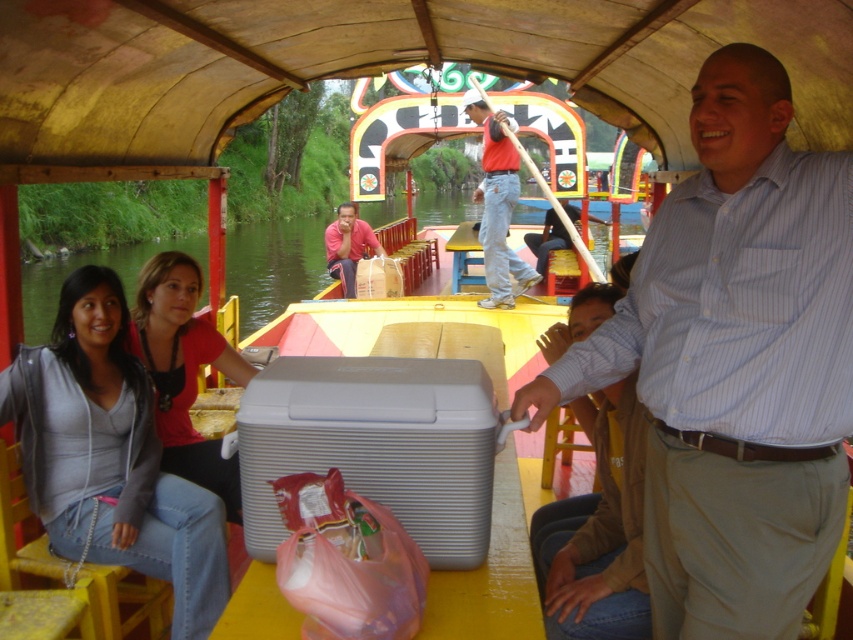
You are a photographer on the boat and want to take a photo of both the striped cotton shirt at center and the matte blue shirt at center. Since you want them both in focus, you need to know which one is taller. Which shirt is taller?

The striped cotton shirt at center is taller than the matte blue shirt at center.

Based on the photo, you are standing on the boat and want to hand a souvenir to a person wearing the striped cotton shirt at center. If you can reach up to 2 meters, will you be able to reach them?

The striped cotton shirt at center and the viewer are 2.40 meters apart, so you cannot reach them as your maximum reach is 2 meters.

You are a passenger on the boat and want to grab your matte gray jacket at lower left and your gray ribbed cooler at center. Which item is closer to the left side of the boat?

The matte gray jacket at lower left is closer to the left side of the boat because it is positioned to the left of the gray ribbed cooler at center.